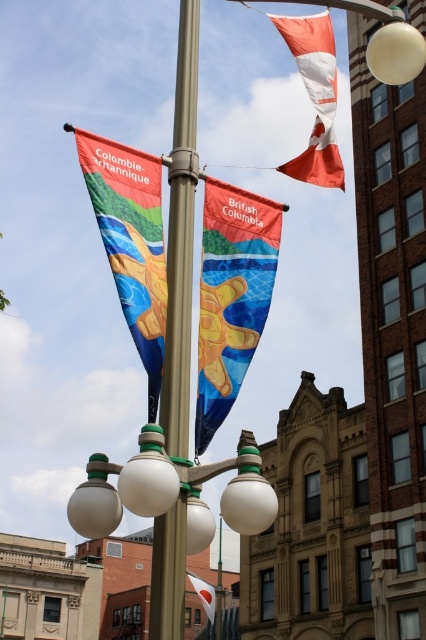
Question: Which point is closer to the camera?

Choices:
 (A) metallic pole at center
 (B) white glossy street light at center
 (C) matte fabric flag at upper left

Answer: (A)

Question: Can you confirm if metallic pole at center is positioned above white glossy street light at center?

Choices:
 (A) no
 (B) yes

Answer: (B)

Question: Is metallic pole at center closer to the viewer compared to matte fabric flag at upper left?

Choices:
 (A) yes
 (B) no

Answer: (A)

Question: Is metallic pole at center below orange fabric flag at upper right?

Choices:
 (A) yes
 (B) no

Answer: (A)

Question: Estimate the real-world distances between objects in this image. Which object is farther from the orange fabric flag at upper right?

Choices:
 (A) matte fabric flag at upper left
 (B) matte fabric flag at center
 (C) white glossy street light at center

Answer: (C)

Question: Which point appears farthest from the camera in this image?

Choices:
 (A) (213, 616)
 (B) (256, 310)
 (C) (319, 29)

Answer: (A)